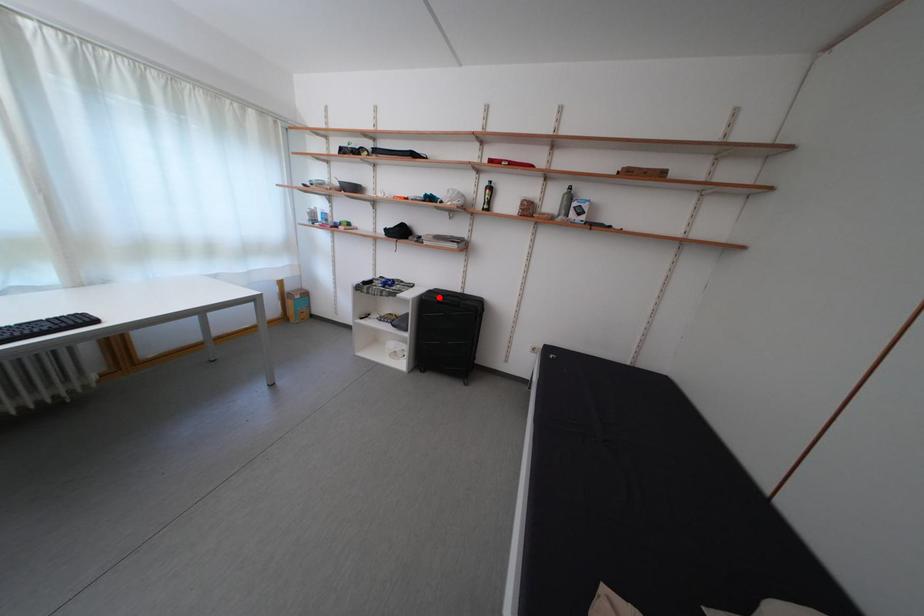
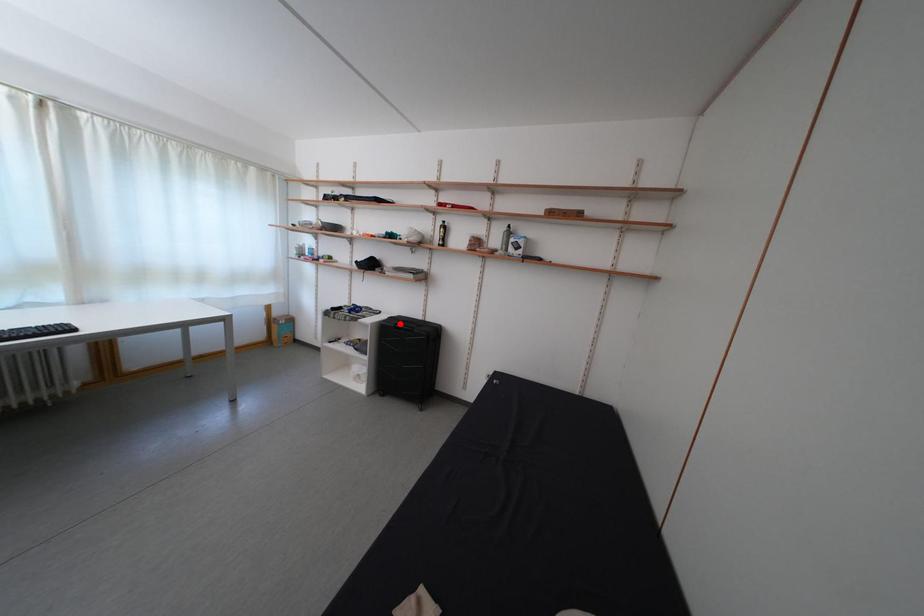
I am providing you with two images of the same scene from different viewpoints. A red point is marked on the first image and another point is marked on the second image. Is the red point in image1 aligned with the point shown in image2?

Yes